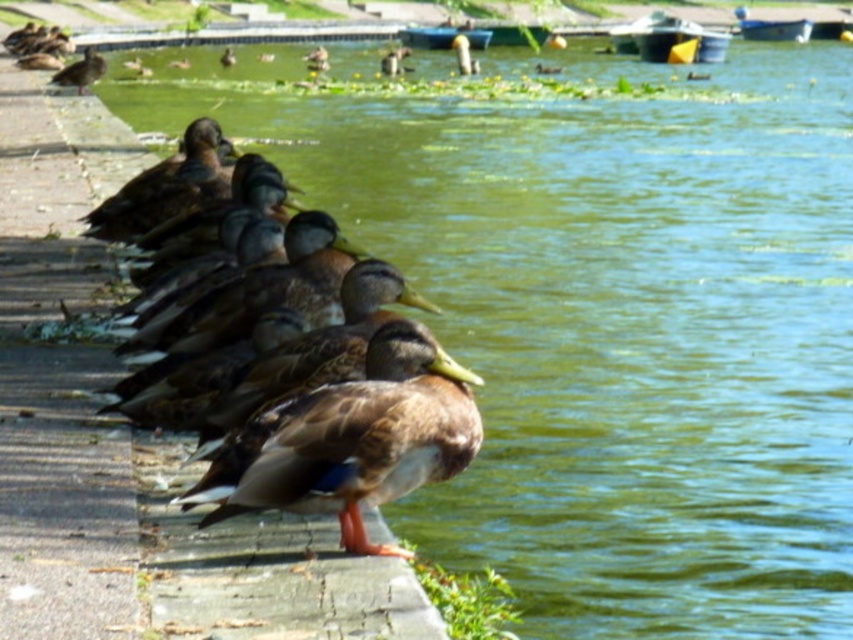
You are standing at the center of the pond edge. You want to approach the brown matte duck at left without getting your feet wet. Which direction should you walk to reach it?

You should walk to the left from the center of the pond edge to reach the brown matte duck at left since it is located at point 0.648 on the x axis, which is to the left side.

You are a photographer trying to capture a closeup shot of the brown matte duck at left and the brown feathered mallard duck at left. Given that your camera can focus on objects within a 1 inch range, will both ducks be in focus?

The brown matte duck at left is 0.84 inches away from the brown feathered mallard duck at left, so yes, both ducks will be within the 1 inch focus range of the camera and thus in focus.

You are standing at the edge of the pond and see the brown matte duck at left. If you want to throw a small pebble to reach the duck, will the distance be less than 7 meters?

The brown matte duck at left is 6.70 meters away from camera, so yes, the distance is less than 7 meters. The pebble can reach it.